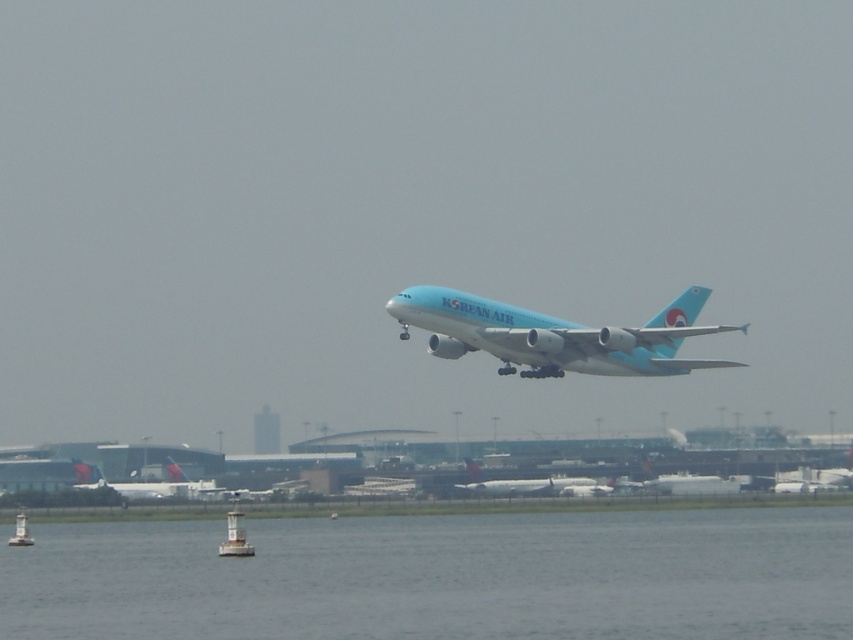
You are a pilot looking at the flight path. You see the transparent water at lower center and the light blue metallic airplane at center. Which object is higher in the image?

The light blue metallic airplane at center is lower than the transparent water at lower center, so the transparent water at lower center is higher in the image.

You are a pilot who just took off from an airport. Looking out the cockpit window, you see the light blue glossy airplane at center and the white plastic buoy at lower left. Which object appears bigger in your view?

The light blue glossy airplane at center appears bigger because it is larger in size than the white plastic buoy at lower left.